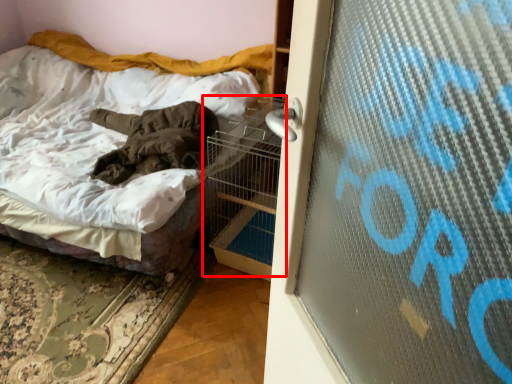
Question: From the image's perspective, where is bird cage (annotated by the red box) located in relation to bed in the image?

Choices:
 (A) below
 (B) above

Answer: (A)